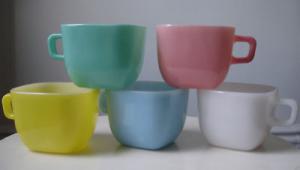
Where is `red cup`? red cup is located at coordinates (x=203, y=42).